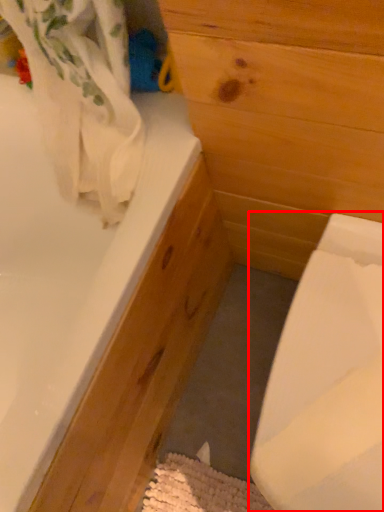
Question: From the image's perspective, where is sink (annotated by the red box) located in relation to bathtub in the image?

Choices:
 (A) below
 (B) above

Answer: (A)